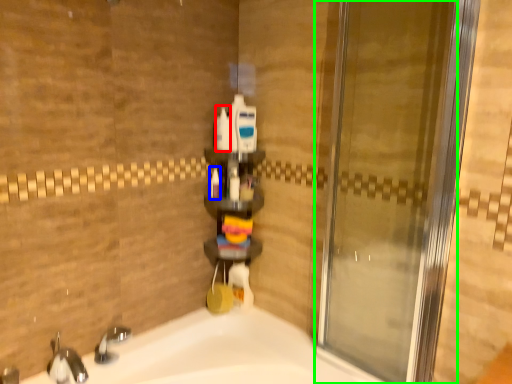
Question: Considering the real-world distances, which object is farthest from toiletry (highlighted by a red box)? toiletry (highlighted by a blue box) or door (highlighted by a green box)?

Choices:
 (A) toiletry
 (B) door

Answer: (B)